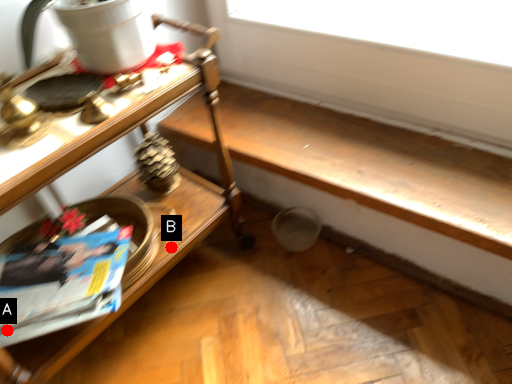
Question: Two points are circled on the image, labeled by A and B beside each circle. Among these points, which one is farthest from the camera?

Choices:
 (A) A is further
 (B) B is further

Answer: (B)